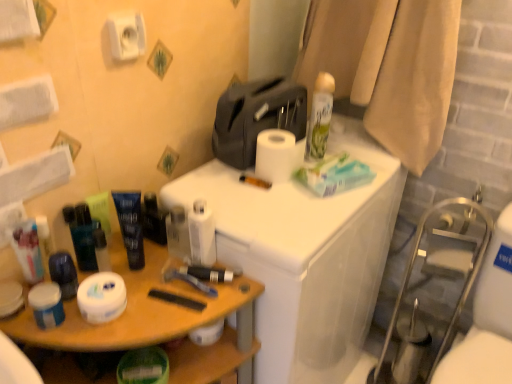
Question: Relative to matte black tube at center, arranged as the first toiletry when viewed from the right, is white matte toilet paper at lower left, which is counted as the fourth toilet paper, starting from the right, in front or behind?

Choices:
 (A) behind
 (B) front

Answer: (B)

Question: In the image, is white matte toilet paper at lower left, placed as the 1th toilet paper when sorted from left to right, on the left side or the right side of matte black tube at center, arranged as the first toiletry when viewed from the right?

Choices:
 (A) right
 (B) left

Answer: (B)

Question: Which is nearer to the matte green tube at left, arranged as the 3th toiletry when viewed from the right?

Choices:
 (A) white plastic toilet at upper right, the 2th counter from the left
 (B) white matte toilet paper at upper center, the first toilet paper positioned from the right
 (C) translucent plastic can at upper right
 (D) white glossy toilet paper at center, arranged as the 3th toilet paper when viewed from the left
 (E) matte black tube at center left, the 4th toiletry in the left-to-right sequence

Answer: (E)

Question: Which object is positioned closest to the white matte toilet paper at upper center, which ranks as the first toilet paper in top-to-bottom order?

Choices:
 (A) white matte jar at left, which appears as the first toiletry when viewed from the left
 (B) matte black tube at center, which is counted as the fifth toiletry, starting from the left
 (C) white matte toilet paper at lower left, the 1th toilet paper positioned from the bottom
 (D) matte green tube at left, arranged as the 3th toiletry when viewed from the right
 (E) white plastic toilet at upper right, which ranks as the 1th counter in right-to-left order

Answer: (D)